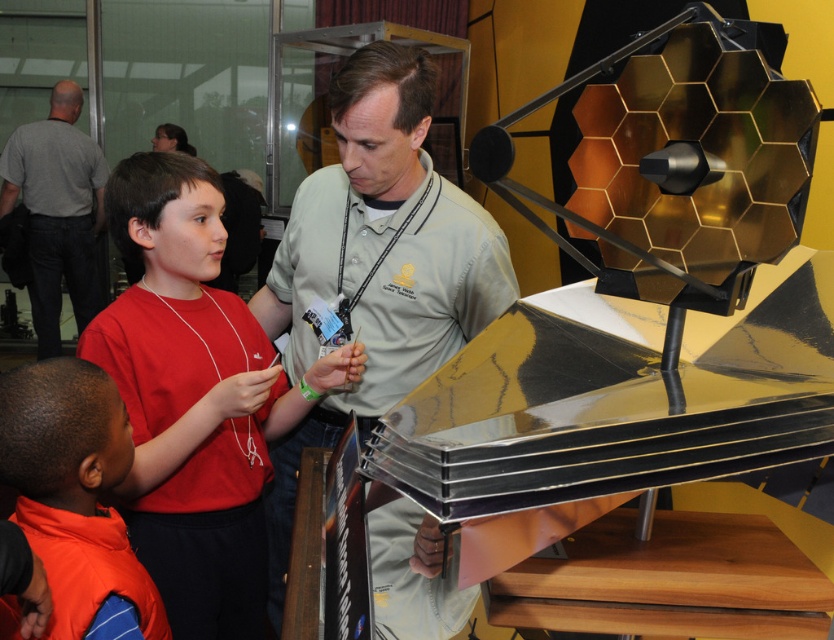
Question: Is the position of green matte shirt at center less distant than that of gray shirt at upper left?

Choices:
 (A) no
 (B) yes

Answer: (B)

Question: Does green matte shirt at center have a larger size compared to orange fleece vest at lower left?

Choices:
 (A) yes
 (B) no

Answer: (A)

Question: Which point is closer to the camera?

Choices:
 (A) (84, 307)
 (B) (441, 248)

Answer: (B)

Question: Which of these objects is positioned closest to the orange fleece vest at lower left?

Choices:
 (A) green matte shirt at center
 (B) matte red shirt at center
 (C) gray shirt at upper left

Answer: (B)

Question: Which point appears closest to the camera in this image?

Choices:
 (A) pyautogui.click(x=54, y=451)
 (B) pyautogui.click(x=355, y=358)

Answer: (A)

Question: Can you confirm if green matte shirt at center is wider than orange fleece vest at lower left?

Choices:
 (A) yes
 (B) no

Answer: (A)